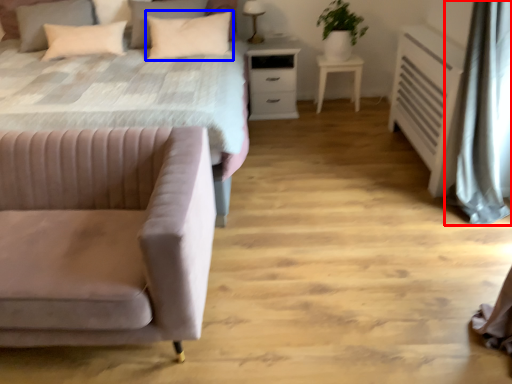
Question: Among these objects, which one is farthest to the camera, curtain (highlighted by a red box) or pillow (highlighted by a blue box)?

Choices:
 (A) curtain
 (B) pillow

Answer: (B)